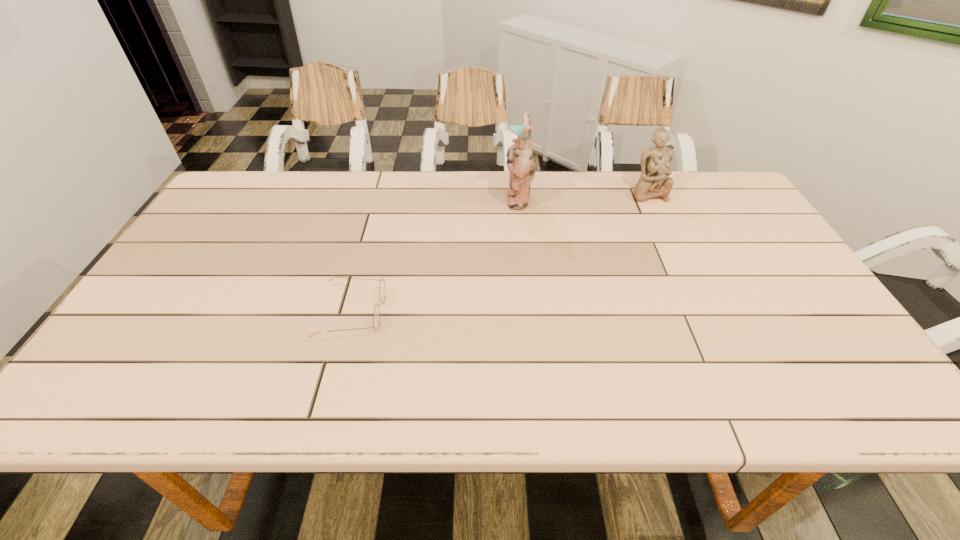
Locate an element on the screen. The height and width of the screenshot is (540, 960). the taller figurine is located at coordinates (520, 161).

Find the location of `the tallest object`. the tallest object is located at coordinates (520, 161).

This screenshot has width=960, height=540. What are the coordinates of `the rightmost object` in the screenshot? It's located at (656, 162).

At what (x,y) coordinates should I click in order to perform the action: click on the right figurine. Please return your answer as a coordinate pair (x, y). The width and height of the screenshot is (960, 540). Looking at the image, I should click on (656, 162).

Locate an element on the screen. Image resolution: width=960 pixels, height=540 pixels. spectacles is located at coordinates (376, 315).

The image size is (960, 540). What are the coordinates of `the leftmost object` in the screenshot? It's located at (376, 315).

Locate an element on the screen. The image size is (960, 540). free location located 0.320m on the front-facing side of the taller figurine is located at coordinates (401, 199).

Identify the location of blank area located 0.300m on the front-facing side of the taller figurine. (408, 199).

Locate an element on the screen. vacant space located on the front-facing side of the taller figurine is located at coordinates tap(466, 199).

Locate an element on the screen. The height and width of the screenshot is (540, 960). vacant area located on the front-facing side of the second tallest object is located at coordinates [x=687, y=277].